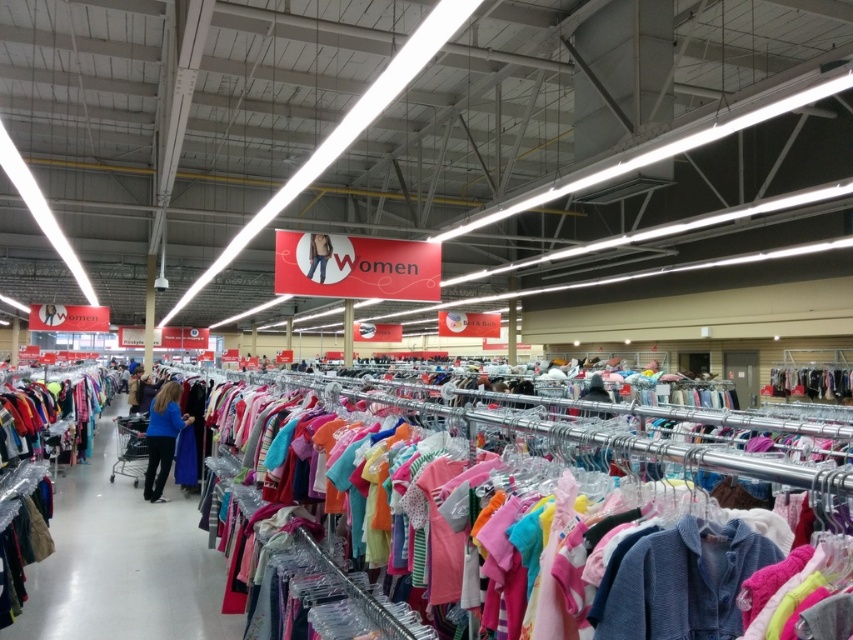
You are a store employee who needs to retrieve a blue cotton shirt at center from the rack. You are currently standing at the entrance of the store, which is 10 feet away from the matte plastic hangers at center. Can you reach the shirt without moving past the hangers?

The matte plastic hangers at center and blue cotton shirt at center are 15.88 feet apart. Since you are 10 feet away from the hangers, the total distance to the shirt is 10 feet plus 15.88 feet, which is 25.88 feet. Therefore, you cannot reach the shirt without moving closer.